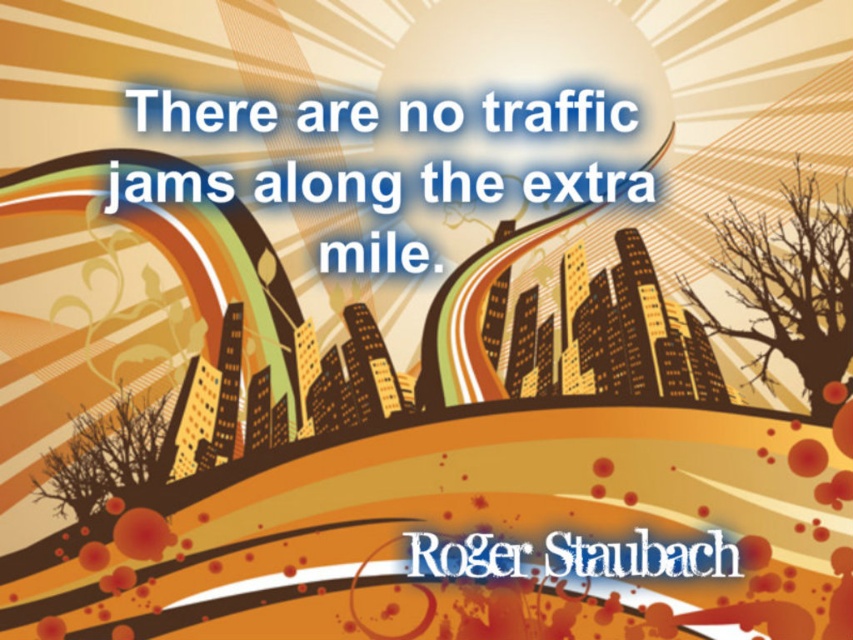
Does point (447, 104) lie in front of point (502, 556)?

No, it is not.

Which is behind, point (485, 188) or point (460, 560)?

The point (485, 188) is more distant.

Does point (486, 196) come farther from viewer compared to point (640, 552)?

That is True.

The image size is (853, 640). In order to click on whitematerial/texturetext at upper center in this screenshot , I will do `click(329, 188)`.